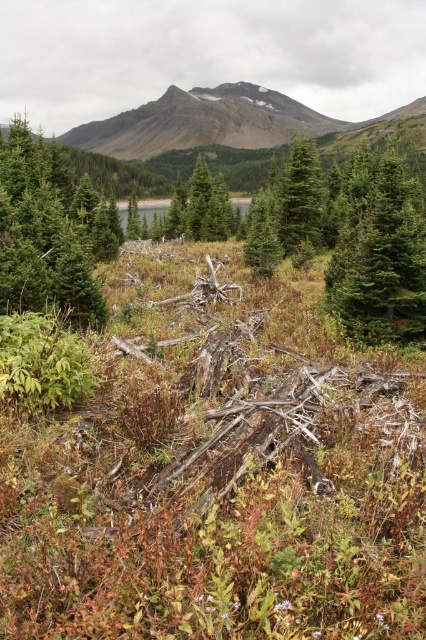
Is green matte evergreen tree at center-right wider than green matte evergreen tree at upper left?

In fact, green matte evergreen tree at center-right might be narrower than green matte evergreen tree at upper left.

Does green matte evergreen tree at center-right have a lesser height compared to green matte evergreen tree at upper left?

Indeed, green matte evergreen tree at center-right has a lesser height compared to green matte evergreen tree at upper left.

Is point (396, 284) positioned after point (69, 314)?

No, (396, 284) is closer to viewer.

Where is `green matte evergreen tree at center-right`? Image resolution: width=426 pixels, height=640 pixels. green matte evergreen tree at center-right is located at coordinates (379, 250).

Does green matte evergreen tree at upper left have a greater width compared to green matte tree at center?

Yes.

Does green matte evergreen tree at upper left lie in front of green matte tree at center?

Yes, it is in front of green matte tree at center.

Describe the element at coordinates (43, 234) in the screenshot. I see `green matte evergreen tree at upper left` at that location.

Image resolution: width=426 pixels, height=640 pixels. In order to click on green matte evergreen tree at upper left in this screenshot , I will do `click(43, 234)`.

Between green matte evergreen tree at center-right and green matte tree at center, which one has more height?

green matte tree at center

Is green matte evergreen tree at center-right taller than green matte tree at center?

In fact, green matte evergreen tree at center-right may be shorter than green matte tree at center.

Is point (362, 211) in front of point (183, 186)?

Yes, it is in front of point (183, 186).

Identify the location of green matte evergreen tree at center-right. This screenshot has width=426, height=640. (379, 250).